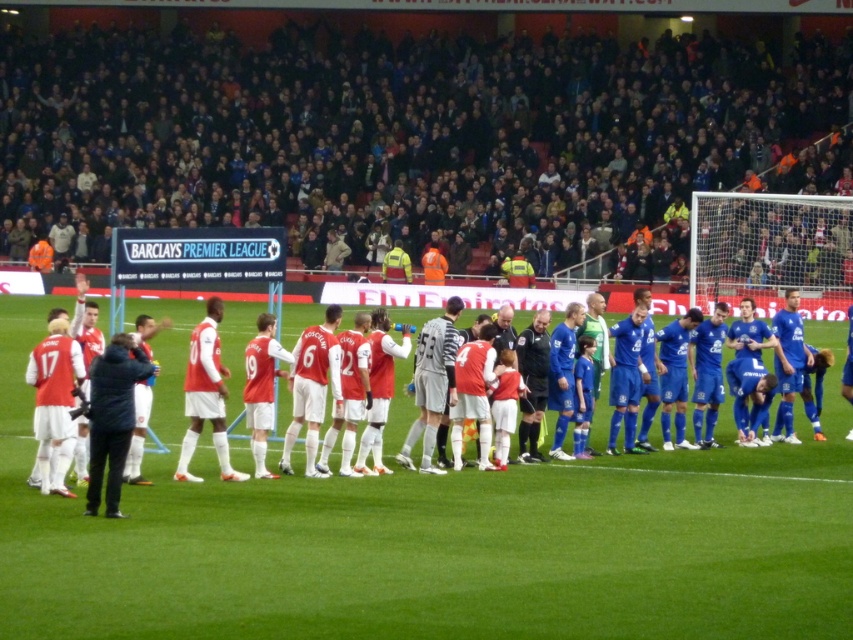
Is point (199, 310) positioned behind point (433, 388)?

Yes.

From the picture: Which of these two, matte red jersey at center or matte gray jersey at center, stands taller?

With more height is matte red jersey at center.

Where is `matte red jersey at center`? The width and height of the screenshot is (853, 640). matte red jersey at center is located at coordinates (744, 449).

Locate an element on the screen. matte red jersey at center is located at coordinates (744, 449).

Is point (321, 312) behind point (97, 397)?

Yes, it is behind point (97, 397).

Is matte red jersey at center below black fabric jacket at left?

Incorrect, matte red jersey at center is not positioned below black fabric jacket at left.

Which is in front, point (543, 472) or point (120, 474)?

Point (120, 474)

You are a GUI agent. You are given a task and a screenshot of the screen. Output one action in this format:
    pyautogui.click(x=<x>, y=<y>)
    Task: Click on the matte red jersey at center
    The image size is (853, 640).
    Given the screenshot: What is the action you would take?
    pyautogui.click(x=744, y=449)

Does black fabric jacket at left have a greater height compared to matte gray jersey at center?

In fact, black fabric jacket at left may be shorter than matte gray jersey at center.

Who is positioned more to the left, black fabric jacket at left or matte gray jersey at center?

black fabric jacket at left is more to the left.

Is point (126, 355) farther from viewer compared to point (437, 330)?

That is False.

I want to click on black fabric jacket at left, so click(x=112, y=417).